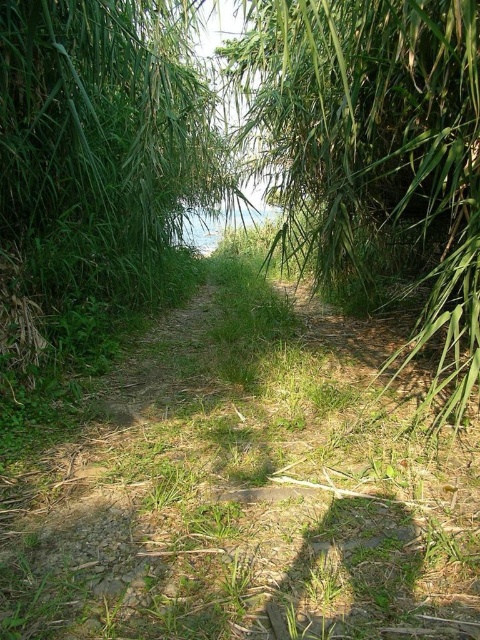
You are a hiker trying to walk along the narrow path. You notice green grass at center and green leafy plant at center. Which one is shorter?

The green grass at center is shorter than the green leafy plant at center.

You are a hiker carrying a 4 feet long backpack. You see the green grass at center and the green leafy plant at center. Can you walk through the path between them without tilting your backpack?

The distance between the green grass at center and the green leafy plant at center is 3.80 feet. Since your backpack is 4 feet long, it is slightly longer than the available space, so you might need to tilt your backpack to fit through the path between them.